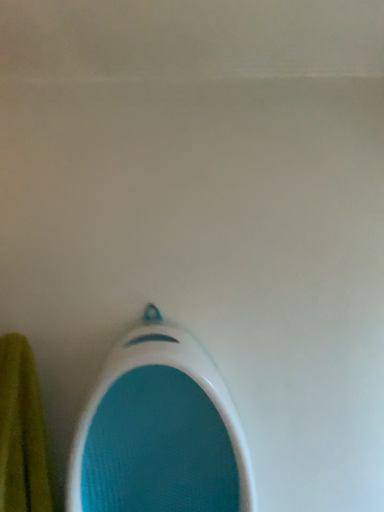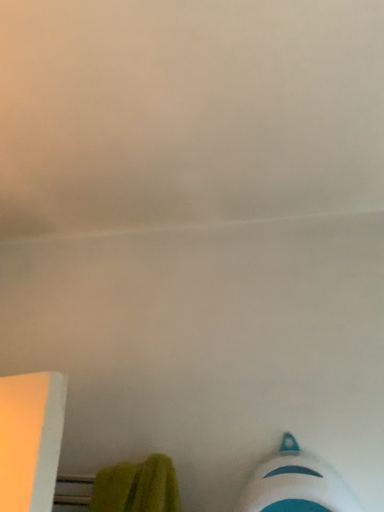
Question: Which way did the camera rotate in the video?

Choices:
 (A) rotated downward
 (B) rotated upward

Answer: (B)